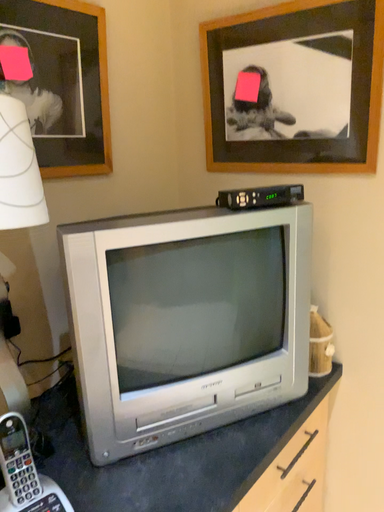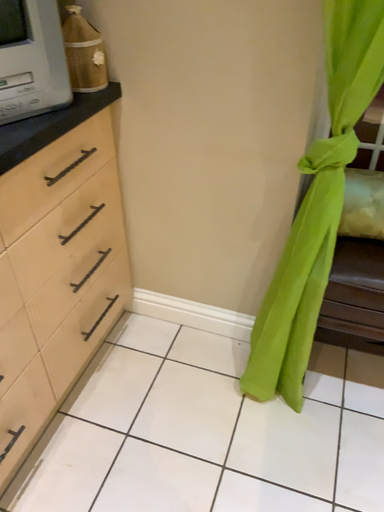
Question: Which way did the camera rotate in the video?

Choices:
 (A) rotated downward
 (B) rotated upward

Answer: (A)